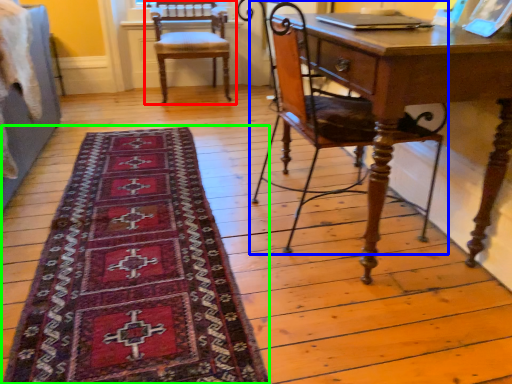
Question: Estimate the real-world distances between objects in this image. Which object is farther from chair (highlighted by a red box), chair (highlighted by a blue box) or mat (highlighted by a green box)?

Choices:
 (A) chair
 (B) mat

Answer: (B)